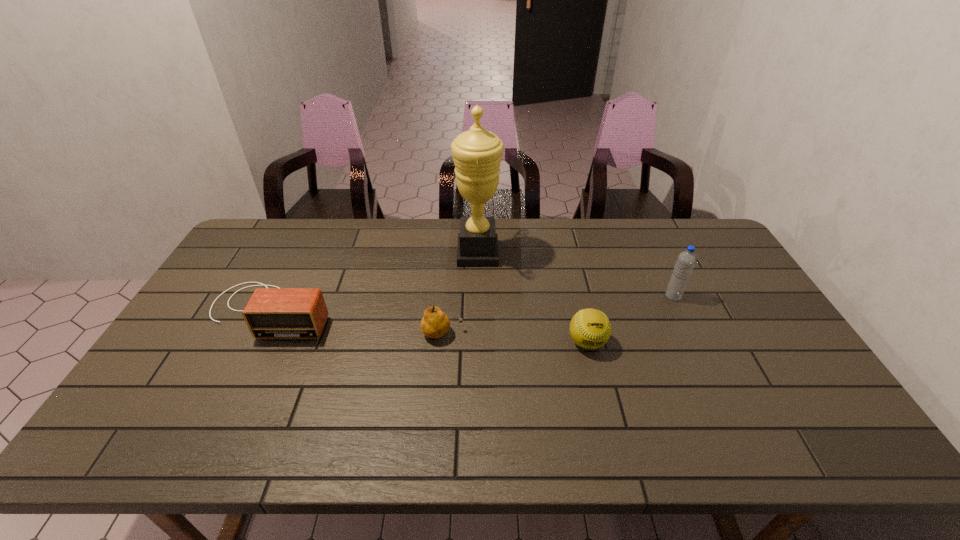
Where is `vacant space that's between the leftmost object and the trophy cup`? Image resolution: width=960 pixels, height=540 pixels. vacant space that's between the leftmost object and the trophy cup is located at coordinates (374, 282).

Where is `object that stands as the closest to the pear`? object that stands as the closest to the pear is located at coordinates (477, 153).

Locate an element on the screen. The image size is (960, 540). object identified as the second closest to the farthest object is located at coordinates click(590, 328).

The height and width of the screenshot is (540, 960). Find the location of `free spot that satisfies the following two spatial constraints: 1. at the front of the trophy cup with handles; 2. on the left side of the fourth shortest object`. free spot that satisfies the following two spatial constraints: 1. at the front of the trophy cup with handles; 2. on the left side of the fourth shortest object is located at coordinates (477, 296).

At what (x,y) coordinates should I click in order to perform the action: click on blank space that satisfies the following two spatial constraints: 1. on the front-facing side of the leftmost object; 2. on the left side of the pear. Please return your answer as a coordinate pair (x, y). Looking at the image, I should click on (259, 333).

You are a GUI agent. You are given a task and a screenshot of the screen. Output one action in this format:
    pyautogui.click(x=<x>, y=<y>)
    Task: Click on the free space that satisfies the following two spatial constraints: 1. at the front of the water bottle with handles; 2. on the left side of the tallest object
    The height and width of the screenshot is (540, 960).
    Given the screenshot: What is the action you would take?
    pyautogui.click(x=477, y=296)

Find the location of `free space that satisfies the following two spatial constraints: 1. at the front of the trophy cup with handles; 2. on the front-facing side of the radio receiver`. free space that satisfies the following two spatial constraints: 1. at the front of the trophy cup with handles; 2. on the front-facing side of the radio receiver is located at coordinates (477, 310).

At what (x,y) coordinates should I click in order to perform the action: click on vacant space that satisfies the following two spatial constraints: 1. at the front of the farthest object with handles; 2. on the right side of the water bottle. Please return your answer as a coordinate pair (x, y). Looking at the image, I should click on (477, 296).

The height and width of the screenshot is (540, 960). I want to click on blank space that satisfies the following two spatial constraints: 1. on the front-facing side of the leftmost object; 2. on the left side of the pear, so click(x=259, y=333).